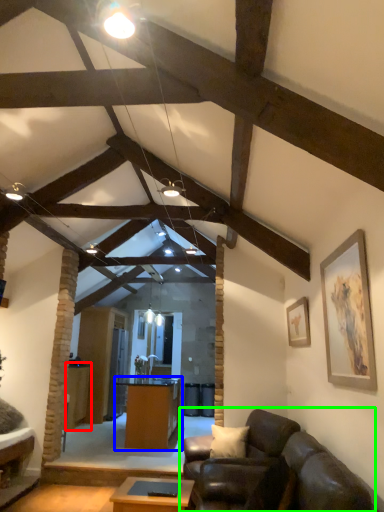
Question: Estimate the real-world distances between objects in this image. Which object is closer to table (highlighted by a red box), desk (highlighted by a blue box) or studio couch (highlighted by a green box)?

Choices:
 (A) desk
 (B) studio couch

Answer: (A)